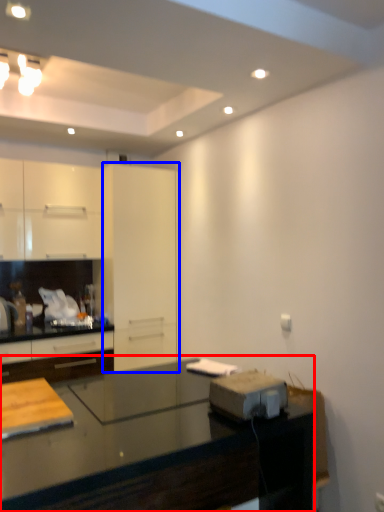
Question: Among these objects, which one is farthest to the camera, countertop (highlighted by a red box) or glass door (highlighted by a blue box)?

Choices:
 (A) countertop
 (B) glass door

Answer: (B)